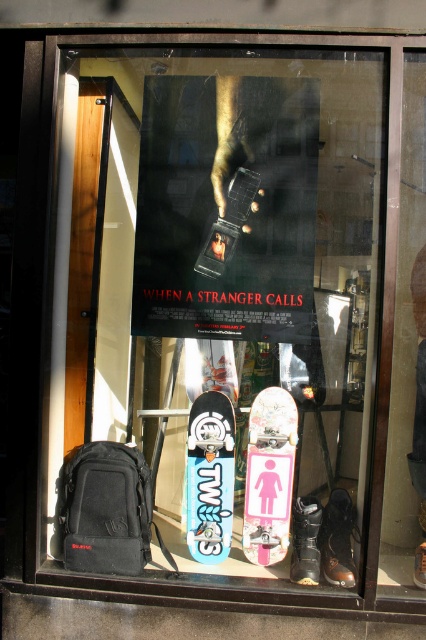
Question: Which point is farther from the camera taking this photo?

Choices:
 (A) (201, 538)
 (B) (252, 488)
 (C) (186, 266)

Answer: (A)

Question: Can you confirm if pink glossy skateboard at center is wider than blue matte skateboard at center?

Choices:
 (A) yes
 (B) no

Answer: (A)

Question: Which point is farther to the camera?

Choices:
 (A) dark matte poster at center
 (B) blue matte skateboard at center
 (C) pink glossy skateboard at center

Answer: (B)

Question: Is pink glossy skateboard at center closer to camera compared to blue matte skateboard at center?

Choices:
 (A) no
 (B) yes

Answer: (B)

Question: Considering the relative positions of dark matte poster at center and blue matte skateboard at center in the image provided, where is dark matte poster at center located with respect to blue matte skateboard at center?

Choices:
 (A) right
 (B) left

Answer: (A)

Question: Which point is closer to the camera?

Choices:
 (A) dark matte poster at center
 (B) pink glossy skateboard at center
 (C) blue matte skateboard at center

Answer: (A)